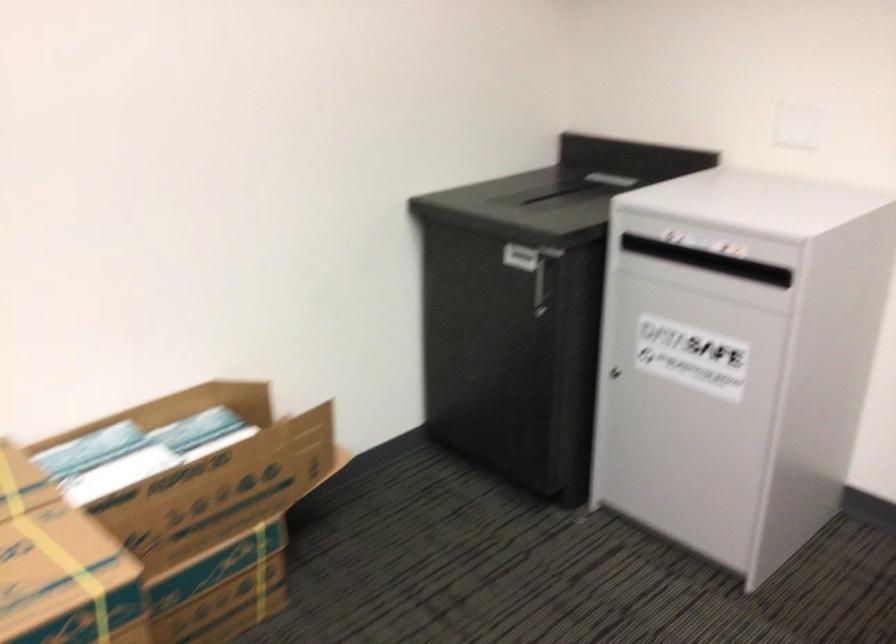
The height and width of the screenshot is (644, 896). I want to click on grey safe slot, so (748, 269).